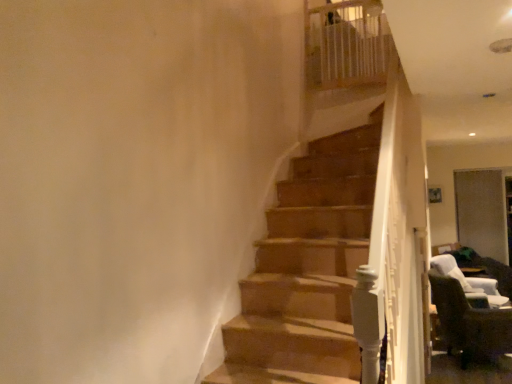
What do you see at coordinates (470, 324) in the screenshot?
I see `brown fabric chair at lower right, the second chair positioned from the back` at bounding box center [470, 324].

This screenshot has width=512, height=384. I want to click on brown fabric chair at lower right, positioned as the first chair in front-to-back order, so tap(470, 324).

Image resolution: width=512 pixels, height=384 pixels. I want to click on white wicker chair at lower right, the second chair positioned from the front, so click(468, 280).

What do you see at coordinates (468, 280) in the screenshot?
I see `white wicker chair at lower right, marked as the 1th chair in a right-to-left arrangement` at bounding box center [468, 280].

In order to face white wicker chair at lower right, the 2th chair in the left-to-right sequence, should I rotate leftwards or rightwards?

You should look right and rotate roughly 27.673 degrees.

Where is `brown fabric chair at lower right, positioned as the first chair in front-to-back order`? brown fabric chair at lower right, positioned as the first chair in front-to-back order is located at coordinates (470, 324).

Which object is positioned more to the right, brown fabric chair at lower right, the first chair from the left, or white wicker chair at lower right, the 2th chair in the left-to-right sequence?

white wicker chair at lower right, the 2th chair in the left-to-right sequence.

Is the position of brown fabric chair at lower right, which is counted as the 2th chair, starting from the right, more distant than that of white wicker chair at lower right, the 2th chair in the left-to-right sequence?

No, brown fabric chair at lower right, which is counted as the 2th chair, starting from the right, is in front of white wicker chair at lower right, the 2th chair in the left-to-right sequence.

Considering the positions of point (443, 295) and point (449, 261), is point (443, 295) closer or farther from the camera than point (449, 261)?

Clearly, point (443, 295) is closer to the camera than point (449, 261).

From the image's perspective, is brown fabric chair at lower right, positioned as the first chair in front-to-back order, under white wicker chair at lower right, the second chair positioned from the front?

Indeed, from the image's perspective, brown fabric chair at lower right, positioned as the first chair in front-to-back order, is shown beneath white wicker chair at lower right, the second chair positioned from the front.

From a real-world perspective, which object stands above the other?

From a 3D spatial view, white wicker chair at lower right, marked as the 1th chair in a right-to-left arrangement, is above.

Considering the sizes of brown fabric chair at lower right, positioned as the first chair in front-to-back order, and white wicker chair at lower right, which appears as the 1th chair when viewed from the back, in the image, is brown fabric chair at lower right, positioned as the first chair in front-to-back order, wider or thinner than white wicker chair at lower right, which appears as the 1th chair when viewed from the back,?

Clearly, brown fabric chair at lower right, positioned as the first chair in front-to-back order, has less width compared to white wicker chair at lower right, which appears as the 1th chair when viewed from the back.

Considering the relative sizes of brown fabric chair at lower right, the second chair positioned from the back, and white wicker chair at lower right, which appears as the 1th chair when viewed from the back, in the image provided, is brown fabric chair at lower right, the second chair positioned from the back, taller than white wicker chair at lower right, which appears as the 1th chair when viewed from the back,?

Indeed, brown fabric chair at lower right, the second chair positioned from the back, has a greater height compared to white wicker chair at lower right, which appears as the 1th chair when viewed from the back.

Can you confirm if brown fabric chair at lower right, the second chair positioned from the back, is bigger than white wicker chair at lower right, the 2th chair in the left-to-right sequence?

Yes, brown fabric chair at lower right, the second chair positioned from the back, is bigger than white wicker chair at lower right, the 2th chair in the left-to-right sequence.

Do you think brown fabric chair at lower right, positioned as the first chair in front-to-back order, is within white wicker chair at lower right, the second chair positioned from the front, or outside of it?

brown fabric chair at lower right, positioned as the first chair in front-to-back order, lies outside white wicker chair at lower right, the second chair positioned from the front.

Based on the photo, is brown fabric chair at lower right, positioned as the first chair in front-to-back order, with white wicker chair at lower right, which appears as the 1th chair when viewed from the back?

There is a gap between brown fabric chair at lower right, positioned as the first chair in front-to-back order, and white wicker chair at lower right, which appears as the 1th chair when viewed from the back.

Could you tell me if brown fabric chair at lower right, positioned as the first chair in front-to-back order, is turned towards white wicker chair at lower right, marked as the 1th chair in a right-to-left arrangement?

No, brown fabric chair at lower right, positioned as the first chair in front-to-back order, is not turned towards white wicker chair at lower right, marked as the 1th chair in a right-to-left arrangement.

Could you measure the distance between brown fabric chair at lower right, which is counted as the 2th chair, starting from the right, and white wicker chair at lower right, the 2th chair in the left-to-right sequence?

10.39 inches.

There is a brown fabric chair at lower right, which is counted as the 2th chair, starting from the right. Where is `chair above it (from a real-world perspective)`? The height and width of the screenshot is (384, 512). chair above it (from a real-world perspective) is located at coordinates (468, 280).

Consider the image. Considering the relative positions of white wicker chair at lower right, which appears as the 1th chair when viewed from the back, and brown fabric chair at lower right, positioned as the first chair in front-to-back order, in the image provided, is white wicker chair at lower right, which appears as the 1th chair when viewed from the back, to the left of brown fabric chair at lower right, positioned as the first chair in front-to-back order, from the viewer's perspective?

No, white wicker chair at lower right, which appears as the 1th chair when viewed from the back, is not to the left of brown fabric chair at lower right, positioned as the first chair in front-to-back order.

Is the depth of white wicker chair at lower right, which appears as the 1th chair when viewed from the back, greater than that of brown fabric chair at lower right, the first chair from the left?

Yes, it is behind brown fabric chair at lower right, the first chair from the left.

Which is in front, point (503, 296) or point (490, 318)?

The point (490, 318) is in front.

From the image's perspective, which is below, white wicker chair at lower right, which appears as the 1th chair when viewed from the back, or brown fabric chair at lower right, the second chair positioned from the back?

brown fabric chair at lower right, the second chair positioned from the back, from the image's perspective.

In the scene shown: From a real-world perspective, which is physically above, white wicker chair at lower right, the 2th chair in the left-to-right sequence, or brown fabric chair at lower right, positioned as the first chair in front-to-back order?

white wicker chair at lower right, the 2th chair in the left-to-right sequence, from a real-world perspective.

Between white wicker chair at lower right, which appears as the 1th chair when viewed from the back, and brown fabric chair at lower right, the second chair positioned from the back, which one has larger width?

white wicker chair at lower right, which appears as the 1th chair when viewed from the back, is wider.

From their relative heights in the image, would you say white wicker chair at lower right, the 2th chair in the left-to-right sequence, is taller or shorter than brown fabric chair at lower right, the second chair positioned from the back?

In the image, white wicker chair at lower right, the 2th chair in the left-to-right sequence, appears to be shorter than brown fabric chair at lower right, the second chair positioned from the back.

Is white wicker chair at lower right, the second chair positioned from the front, bigger or smaller than brown fabric chair at lower right, which is counted as the 2th chair, starting from the right?

In the image, white wicker chair at lower right, the second chair positioned from the front, appears to be smaller than brown fabric chair at lower right, which is counted as the 2th chair, starting from the right.

Could brown fabric chair at lower right, which is counted as the 2th chair, starting from the right, be considered to be inside white wicker chair at lower right, which appears as the 1th chair when viewed from the back?

No, brown fabric chair at lower right, which is counted as the 2th chair, starting from the right, is not surrounded by white wicker chair at lower right, which appears as the 1th chair when viewed from the back.

Based on the photo, is white wicker chair at lower right, the 2th chair in the left-to-right sequence, next to brown fabric chair at lower right, which is counted as the 2th chair, starting from the right, and touching it?

No, white wicker chair at lower right, the 2th chair in the left-to-right sequence, is not with brown fabric chair at lower right, which is counted as the 2th chair, starting from the right.

Is brown fabric chair at lower right, the first chair from the left, at the back of white wicker chair at lower right, marked as the 1th chair in a right-to-left arrangement?

No, white wicker chair at lower right, marked as the 1th chair in a right-to-left arrangement,'s orientation is not away from brown fabric chair at lower right, the first chair from the left.

How much distance is there between white wicker chair at lower right, the 2th chair in the left-to-right sequence, and brown fabric chair at lower right, positioned as the first chair in front-to-back order?

A distance of 10.39 inches exists between white wicker chair at lower right, the 2th chair in the left-to-right sequence, and brown fabric chair at lower right, positioned as the first chair in front-to-back order.

Find the location of a particular element. The height and width of the screenshot is (384, 512). chair behind the brown fabric chair at lower right, which is counted as the 2th chair, starting from the right is located at coordinates (468, 280).

You are a GUI agent. You are given a task and a screenshot of the screen. Output one action in this format:
    pyautogui.click(x=<x>, y=<y>)
    Task: Click on the chair that is below the white wicker chair at lower right, which appears as the 1th chair when viewed from the back (from the image's perspective)
    The width and height of the screenshot is (512, 384).
    Given the screenshot: What is the action you would take?
    pyautogui.click(x=470, y=324)

Where is `chair above the brown fabric chair at lower right, the second chair positioned from the back (from a real-world perspective)`? The width and height of the screenshot is (512, 384). chair above the brown fabric chair at lower right, the second chair positioned from the back (from a real-world perspective) is located at coordinates [468, 280].